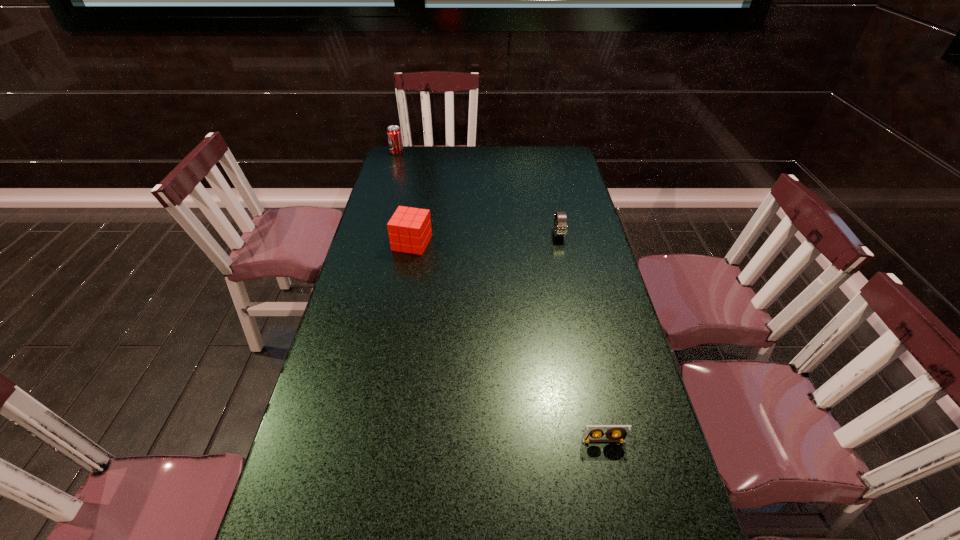
You are a GUI agent. You are given a task and a screenshot of the screen. Output one action in this format:
    pyautogui.click(x=<x>, y=<y>)
    Task: Click on the object that is the closest to the videotape
    The image size is (960, 540).
    Given the screenshot: What is the action you would take?
    pyautogui.click(x=560, y=229)

Point out which object is positioned as the nearest to the leftmost object. Please provide its 2D coordinates. Your answer should be formatted as a tuple, i.e. [(x, y)], where the tuple contains the x and y coordinates of a point satisfying the conditions above.

[(409, 229)]